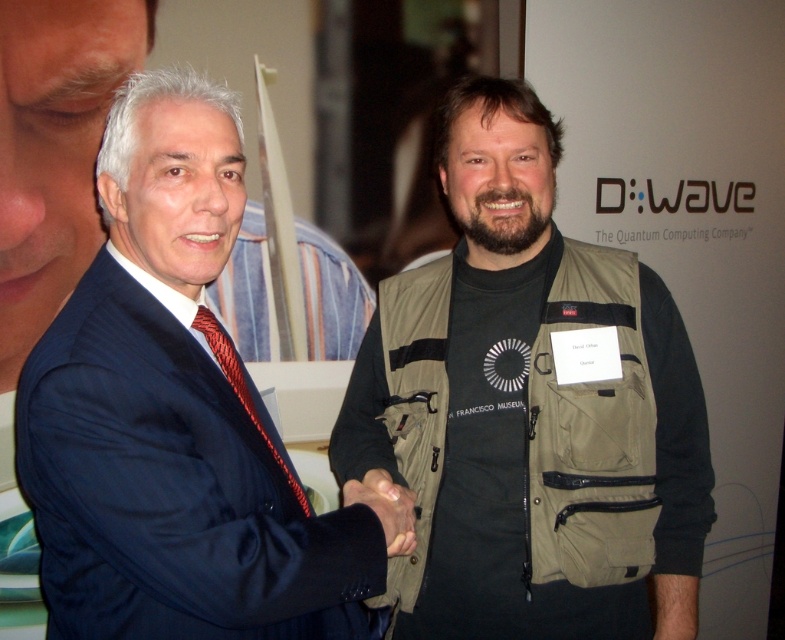
Does khaki fabric vest at center appear on the right side of matte blue suit at center?

Correct, you'll find khaki fabric vest at center to the right of matte blue suit at center.

Who is positioned more to the right, khaki fabric vest at center or matte blue suit at center?

khaki fabric vest at center

Does point (363, 420) lie behind point (126, 241)?

Yes, point (363, 420) is behind point (126, 241).

This screenshot has height=640, width=785. I want to click on khaki fabric vest at center, so click(x=528, y=410).

Can you confirm if khaki fabric vest at center is positioned below smooth skin hand at center?

Actually, khaki fabric vest at center is above smooth skin hand at center.

Between point (689, 611) and point (382, 477), which one is positioned in front?

Point (382, 477)

Locate an element on the screen. The height and width of the screenshot is (640, 785). khaki fabric vest at center is located at coordinates (528, 410).

Does matte blue suit at center have a lesser height compared to smooth skin hand at center?

Incorrect, matte blue suit at center's height does not fall short of smooth skin hand at center's.

Describe the element at coordinates (174, 416) in the screenshot. I see `matte blue suit at center` at that location.

At what (x,y) coordinates should I click in order to perform the action: click on matte blue suit at center. Please return your answer as a coordinate pair (x, y). Looking at the image, I should click on (174, 416).

You are a GUI agent. You are given a task and a screenshot of the screen. Output one action in this format:
    pyautogui.click(x=<x>, y=<y>)
    Task: Click on the matte blue suit at center
    This screenshot has height=640, width=785.
    Given the screenshot: What is the action you would take?
    pyautogui.click(x=174, y=416)